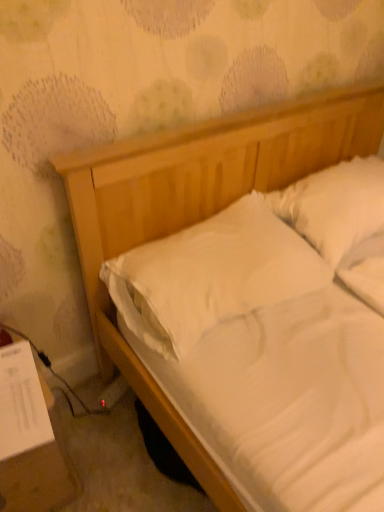
Question: Is white soft pillow at center, which appears as the first pillow when viewed from the left, in front of or behind white paper at lower left in the image?

Choices:
 (A) behind
 (B) front

Answer: (A)

Question: From the image's perspective, is white soft pillow at center, which appears as the first pillow when viewed from the left, located above or below white paper at lower left?

Choices:
 (A) below
 (B) above

Answer: (B)

Question: Considering the real-world distances, which object is closest to the white soft pillow at center, which ranks as the 2th pillow in right-to-left order?

Choices:
 (A) white soft pillow at upper right, the 2th pillow in the left-to-right sequence
 (B) white paper at lower left

Answer: (A)

Question: Which is farther from the white soft pillow at center, which appears as the first pillow when viewed from the left?

Choices:
 (A) white soft pillow at upper right, which is counted as the first pillow, starting from the right
 (B) white paper at lower left

Answer: (B)